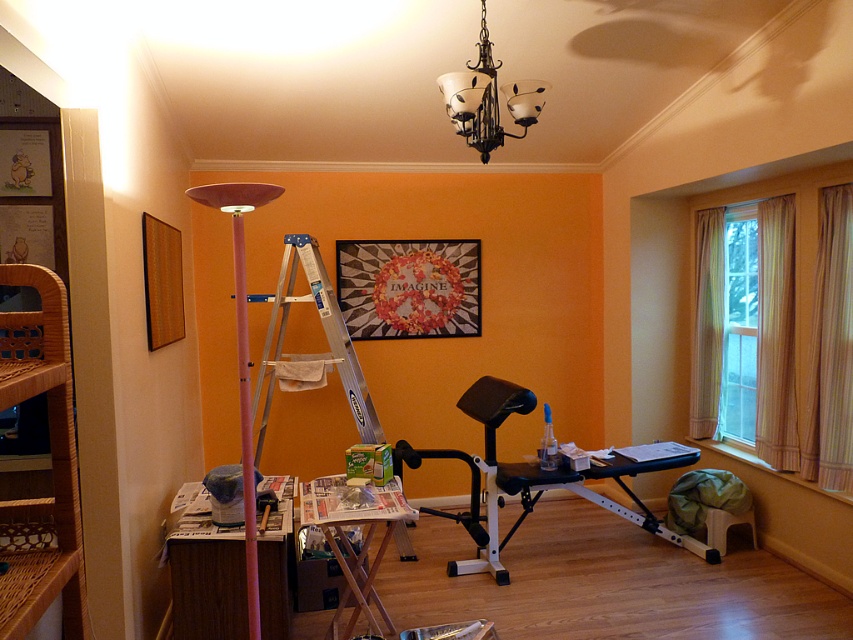
You are standing in the room and see two points marked on the floor. The first point is at coordinates point (456, 246) and the second is at point (289, 490). Which point is closer to you?

Point (289, 490) is closer to you because point (456, 246) is behind it.

You are standing in the room and want to hang a new painting. You see the wooden picture frame at left and the clear glass window at right. Which object is closer to you, the observer?

The wooden picture frame at left is behind the clear glass window at right, so the clear glass window at right is closer to you.